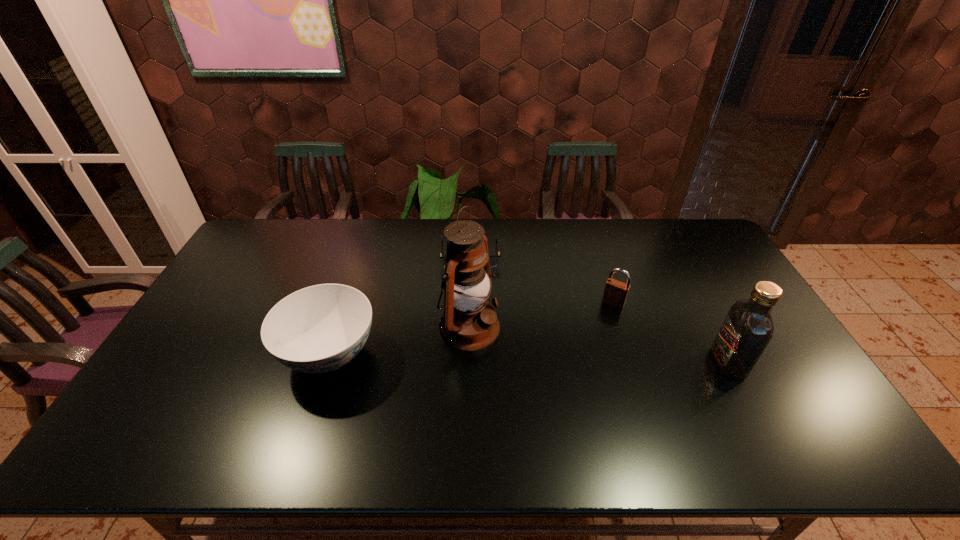
The width and height of the screenshot is (960, 540). In order to click on free area in between the padlock and the shortest object in this screenshot , I will do `click(541, 278)`.

This screenshot has width=960, height=540. What are the coordinates of `free space between the rightmost object and the chinaware` in the screenshot? It's located at (529, 359).

This screenshot has height=540, width=960. I want to click on free space between the leftmost object and the tallest object, so click(x=399, y=341).

Identify the location of free area in between the leftmost object and the shortest object. This screenshot has width=960, height=540. 399,303.

Where is `free space between the chinaware and the spectacles`? Image resolution: width=960 pixels, height=540 pixels. free space between the chinaware and the spectacles is located at coordinates (399, 303).

What are the coordinates of `free space between the tallest object and the rightmost object` in the screenshot? It's located at (599, 345).

Where is `the third closest object to the lantern`? Image resolution: width=960 pixels, height=540 pixels. the third closest object to the lantern is located at coordinates (615, 294).

Where is `object that can be found as the fourth closest to the farthest object`? The width and height of the screenshot is (960, 540). object that can be found as the fourth closest to the farthest object is located at coordinates (747, 329).

The image size is (960, 540). I want to click on blank space that satisfies the following two spatial constraints: 1. on the front side of the vodka; 2. on the front-facing side of the chinaware, so click(x=326, y=362).

Identify the location of free spot that satisfies the following two spatial constraints: 1. on the back side of the leftmost object; 2. on the right side of the fourth object from left to right. (347, 303).